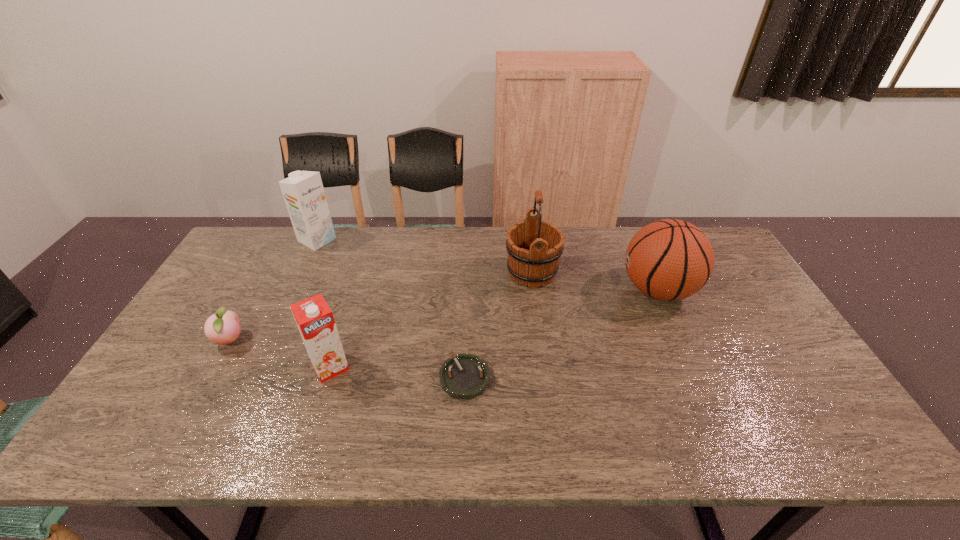
Where is `vacant area between the wine bucket and the peach`? The width and height of the screenshot is (960, 540). vacant area between the wine bucket and the peach is located at coordinates (381, 306).

The image size is (960, 540). In order to click on empty location between the wine bucket and the farther carton in this screenshot , I will do `click(424, 256)`.

Locate an element on the screen. vacant area between the shortest object and the wine bucket is located at coordinates (498, 325).

Select which object is the fifth closest to the wine bucket. Please provide its 2D coordinates. Your answer should be formatted as a tuple, i.e. [(x, y)], where the tuple contains the x and y coordinates of a point satisfying the conditions above.

[(223, 327)]

At what (x,y) coordinates should I click in order to perform the action: click on object that ranks as the closest to the ashtray. Please return your answer as a coordinate pair (x, y). The image size is (960, 540). Looking at the image, I should click on pyautogui.click(x=315, y=321).

Locate an element on the screen. This screenshot has width=960, height=540. free location that satisfies the following two spatial constraints: 1. on the side where the inflation valve is located; 2. on the front side of the third object from right to left is located at coordinates (697, 378).